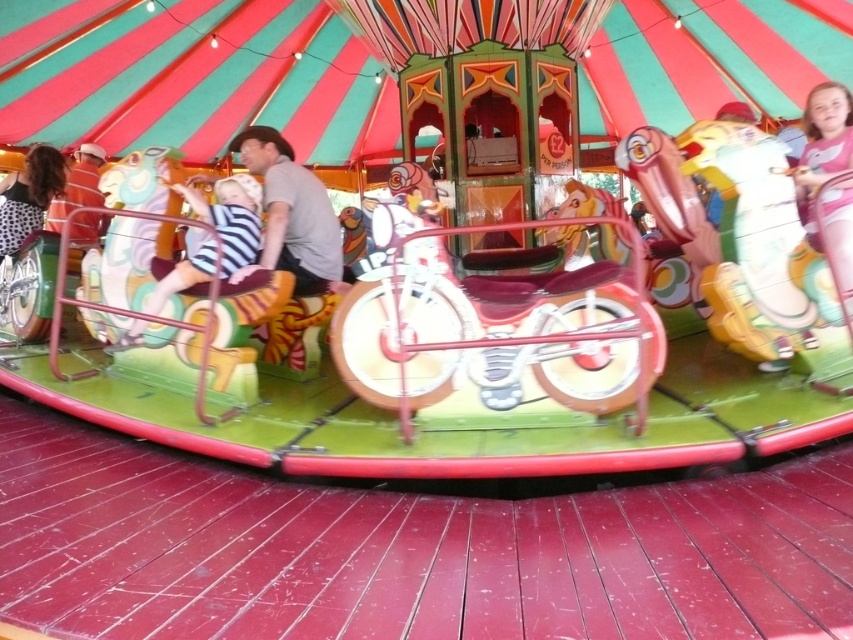
Can you confirm if striped fabric shirt at center is shorter than spotted fabric shirt at upper left?

No.

This screenshot has height=640, width=853. Find the location of `striped fabric shirt at center`. striped fabric shirt at center is located at coordinates (216, 236).

Is pink fabric dress at upper right to the right of spotted fabric shirt at upper left from the viewer's perspective?

Yes, pink fabric dress at upper right is to the right of spotted fabric shirt at upper left.

Can you confirm if pink fabric dress at upper right is shorter than spotted fabric shirt at upper left?

In fact, pink fabric dress at upper right may be taller than spotted fabric shirt at upper left.

Based on the photo, who is more distant from viewer, (846, 260) or (19, 244)?

The point (19, 244) is behind.

I want to click on pink fabric dress at upper right, so click(824, 136).

Between point (280, 252) and point (42, 150), which one is positioned behind?

Point (42, 150)

Does matte gray shirt at center appear over spotted fabric shirt at upper left?

Incorrect, matte gray shirt at center is not positioned above spotted fabric shirt at upper left.

Between point (300, 285) and point (10, 189), which one is positioned behind?

The point (10, 189) is behind.

This screenshot has width=853, height=640. Find the location of `matte gray shirt at center`. matte gray shirt at center is located at coordinates (292, 212).